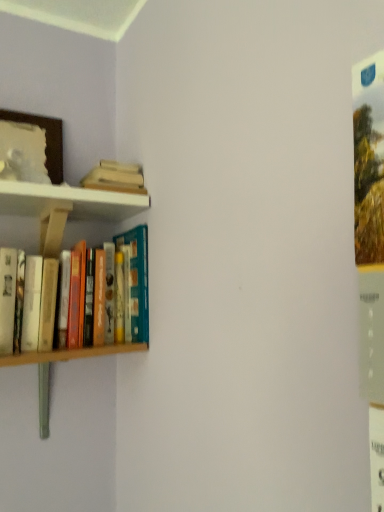
Question: Does hardcover books at left, which appears as the 2th book when viewed from the top, have a larger size compared to hardcover book at upper left, the first book viewed from the top?

Choices:
 (A) yes
 (B) no

Answer: (A)

Question: Considering the relative positions of hardcover books at left, the first book when ordered from bottom to top, and hardcover book at upper left, arranged as the 2th book when ordered from the bottom, in the image provided, is hardcover books at left, the first book when ordered from bottom to top, to the left of hardcover book at upper left, arranged as the 2th book when ordered from the bottom, from the viewer's perspective?

Choices:
 (A) no
 (B) yes

Answer: (B)

Question: Is hardcover books at left, which appears as the 2th book when viewed from the top, wider than hardcover book at upper left, arranged as the 2th book when ordered from the bottom?

Choices:
 (A) yes
 (B) no

Answer: (A)

Question: Is hardcover books at left, which appears as the 2th book when viewed from the top, behind hardcover book at upper left, the first book viewed from the top?

Choices:
 (A) no
 (B) yes

Answer: (A)

Question: From a real-world perspective, is hardcover books at left, which appears as the 2th book when viewed from the top, beneath hardcover book at upper left, the first book viewed from the top?

Choices:
 (A) no
 (B) yes

Answer: (B)

Question: Looking at their shapes, would you say hardcover book at upper left, arranged as the 2th book when ordered from the bottom, is wider or thinner than hardcover books at left, which appears as the 2th book when viewed from the top?

Choices:
 (A) thin
 (B) wide

Answer: (A)

Question: From the image's perspective, is hardcover book at upper left, arranged as the 2th book when ordered from the bottom, above or below hardcover books at left, the first book when ordered from bottom to top?

Choices:
 (A) above
 (B) below

Answer: (A)

Question: Is point (114, 176) closer or farther from the camera than point (33, 362)?

Choices:
 (A) farther
 (B) closer

Answer: (A)

Question: Is hardcover book at upper left, arranged as the 2th book when ordered from the bottom, taller or shorter than hardcover books at left, which appears as the 2th book when viewed from the top?

Choices:
 (A) short
 (B) tall

Answer: (A)

Question: Considering the positions of hardcover books at left, which appears as the 2th book when viewed from the top, and wooden picture frame at upper left in the image, is hardcover books at left, which appears as the 2th book when viewed from the top, taller or shorter than wooden picture frame at upper left?

Choices:
 (A) tall
 (B) short

Answer: (A)

Question: Looking at their shapes, would you say hardcover books at left, which appears as the 2th book when viewed from the top, is wider or thinner than wooden picture frame at upper left?

Choices:
 (A) wide
 (B) thin

Answer: (A)

Question: From a real-world perspective, is hardcover books at left, which appears as the 2th book when viewed from the top, physically located above or below wooden picture frame at upper left?

Choices:
 (A) above
 (B) below

Answer: (B)

Question: Is hardcover books at left, the first book when ordered from bottom to top, in front of or behind wooden picture frame at upper left in the image?

Choices:
 (A) front
 (B) behind

Answer: (A)

Question: From the image's perspective, relative to hardcover book at upper left, arranged as the 2th book when ordered from the bottom, is wooden picture frame at upper left above or below?

Choices:
 (A) above
 (B) below

Answer: (A)

Question: Based on their sizes in the image, would you say wooden picture frame at upper left is bigger or smaller than hardcover book at upper left, the first book viewed from the top?

Choices:
 (A) big
 (B) small

Answer: (A)